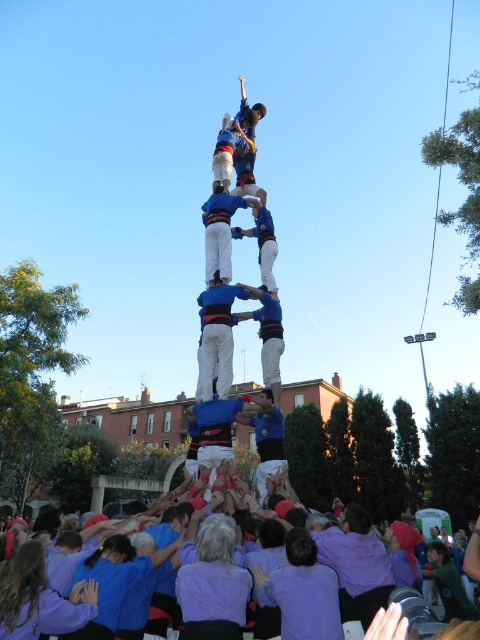
Question: Is purple cotton shirts at lower center thinner than white cotton shirt at center?

Choices:
 (A) no
 (B) yes

Answer: (A)

Question: Which object appears closest to the camera in this image?

Choices:
 (A) purple cotton shirts at lower center
 (B) white cotton shirt at center
 (C) blue fabric person at center

Answer: (A)

Question: Which object is positioned farthest from the white cotton shirt at center?

Choices:
 (A) blue fabric person at center
 (B) purple cotton shirts at lower center

Answer: (B)

Question: Can you confirm if purple cotton shirts at lower center is positioned to the right of white cotton shirt at center?

Choices:
 (A) yes
 (B) no

Answer: (B)

Question: Where is purple cotton shirts at lower center located in relation to white cotton shirt at center in the image?

Choices:
 (A) right
 (B) left

Answer: (B)

Question: Which point is closer to the camera?

Choices:
 (A) purple cotton shirts at lower center
 (B) white cotton shirt at center
 (C) blue fabric person at center

Answer: (A)